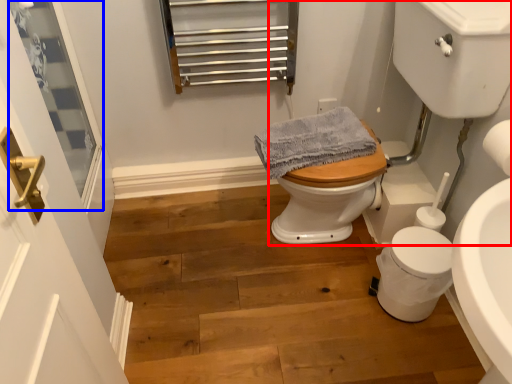
Question: Which point is closer to the camera, sink (highlighted by a red box) or window screen (highlighted by a blue box)?

Choices:
 (A) sink
 (B) window screen

Answer: (A)